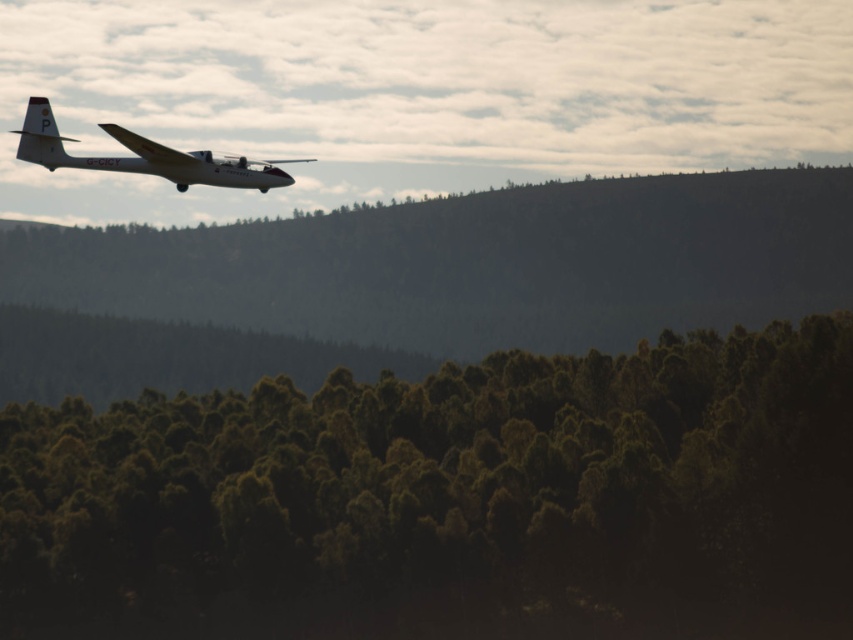
Question: Which object appears farthest from the camera in this image?

Choices:
 (A) green textured trees at lower center
 (B) green textured hillside at upper center

Answer: (B)

Question: Can you confirm if green textured trees at lower center is positioned below green textured hillside at upper center?

Choices:
 (A) yes
 (B) no

Answer: (A)

Question: Observing the image, what is the correct spatial positioning of green textured trees at lower center in reference to matte white airplane at upper left?

Choices:
 (A) below
 (B) above

Answer: (A)

Question: Among these points, which one is nearest to the camera?

Choices:
 (A) (100, 561)
 (B) (294, 227)
 (C) (51, 141)

Answer: (C)

Question: Which object appears closest to the camera in this image?

Choices:
 (A) green textured trees at lower center
 (B) green textured hillside at upper center
 (C) matte white airplane at upper left

Answer: (C)

Question: Does green textured hillside at upper center have a larger size compared to matte white airplane at upper left?

Choices:
 (A) yes
 (B) no

Answer: (A)